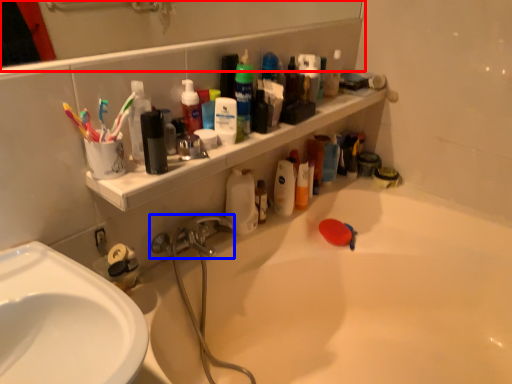
Question: Which of the following is the farthest to the observer, mirror (highlighted by a red box) or tap (highlighted by a blue box)?

Choices:
 (A) mirror
 (B) tap

Answer: (B)